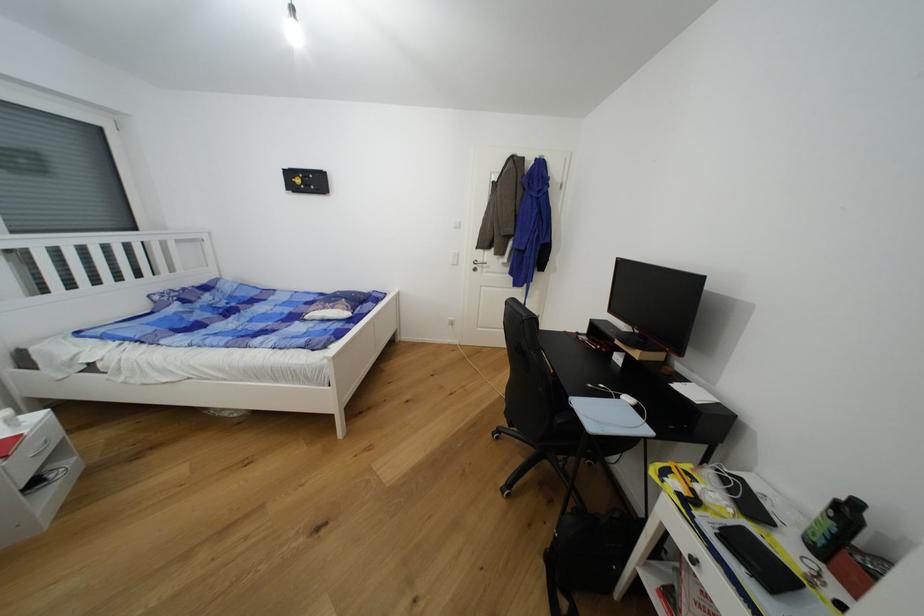
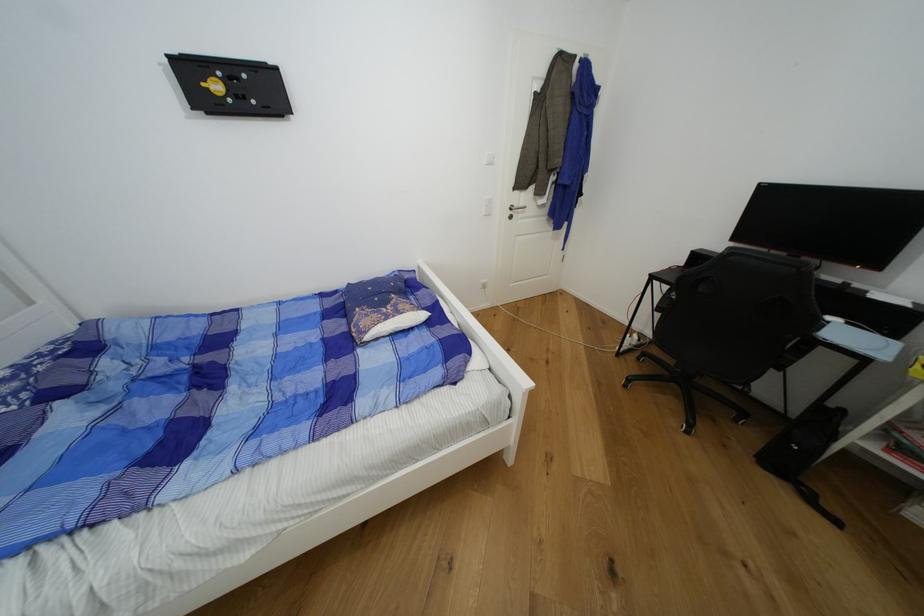
Locate, in the second image, the point that corresponds to [337,310] in the first image.

(404, 314)